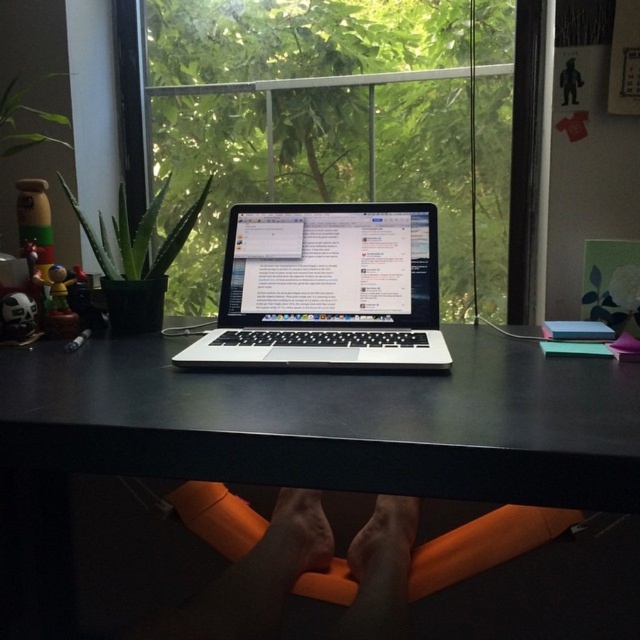
You are organizing a virtual meeting and need to ensure that the background is as clear as possible. Given the setup, which object between the transparent glass window at center and the black matte computer desk at center should you position yourself in front of to minimize background distractions?

The transparent glass window at center has a larger size compared to the black matte computer desk at center, so positioning yourself in front of the transparent glass window at center would allow for a clearer background with the view of the lush green foliage outside, minimizing distractions from items on the desk.

You are standing in the workspace shown in the image. You need to place a new item exactly at the coordinates point (346, 420). What object will be at that location?

The black matte computer desk at center is located at point (346, 420).